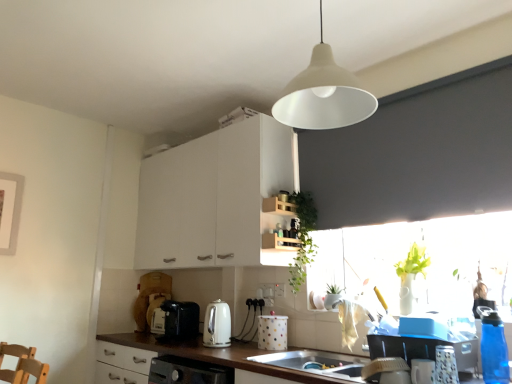
Question: Which is correct: wooden shelf at center is inside white plastic electric outlet at center, the 2th electric outlet when ordered from left to right, or outside of it?

Choices:
 (A) inside
 (B) outside

Answer: (B)

Question: Based on their sizes in the image, would you say wooden shelf at center is bigger or smaller than white plastic electric outlet at center, the 1th electric outlet viewed from the right?

Choices:
 (A) small
 (B) big

Answer: (B)

Question: Which object is positioned farthest from the blue translucent water bottle at right, arranged as the seventh appliance when viewed from the back?

Choices:
 (A) white matte cabinet at upper center
 (B) transparent glass window at right
 (C) black plastic toaster at lower center, arranged as the first appliance when viewed from the back
 (D) blue plastic cups at lower right, the sixth appliance from the left
 (E) white matte lampshade at upper center

Answer: (C)

Question: Estimate the real-world distances between objects in this image. Which object is closer to the white plastic electric outlet at center, which appears as the 2th electric outlet when viewed from the right?

Choices:
 (A) white matte cabinet at upper center
 (B) transparent glass window at right
 (C) blue translucent water bottle at right, the 1th appliance from the right
 (D) black plastic toaster at lower center, arranged as the first appliance when viewed from the back
 (E) wooden shelf at center

Answer: (E)